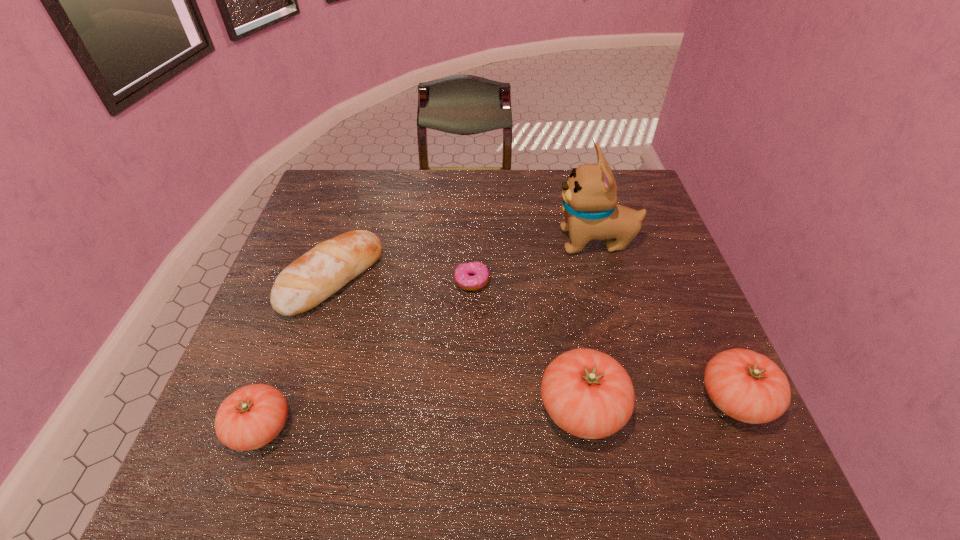
Where is `vacant space located on the back of the second shortest tomato`? The height and width of the screenshot is (540, 960). vacant space located on the back of the second shortest tomato is located at coordinates (682, 277).

Locate an element on the screen. free space located 0.060m on the right of the fourth object from right to left is located at coordinates (514, 281).

Locate an element on the screen. The height and width of the screenshot is (540, 960). free spot located on the front of the bread is located at coordinates (300, 382).

The width and height of the screenshot is (960, 540). I want to click on vacant space located on the face of the puppy, so click(440, 241).

Find the location of a particular element. Image resolution: width=960 pixels, height=540 pixels. free space located on the face of the puppy is located at coordinates (486, 241).

The height and width of the screenshot is (540, 960). In order to click on free spot located on the face of the puppy in this screenshot , I will do `click(461, 241)`.

Locate an element on the screen. Image resolution: width=960 pixels, height=540 pixels. tomato located at the left edge is located at coordinates (252, 416).

You are a GUI agent. You are given a task and a screenshot of the screen. Output one action in this format:
    pyautogui.click(x=<x>, y=<y>)
    Task: Click on the bread situated at the left edge
    
    Given the screenshot: What is the action you would take?
    point(312,278)

At what (x,y) coordinates should I click in order to perform the action: click on tomato located in the right edge section of the desktop. Please return your answer as a coordinate pair (x, y). The image size is (960, 540). Looking at the image, I should click on (747, 386).

The image size is (960, 540). In order to click on puppy at the right edge in this screenshot , I will do `click(590, 207)`.